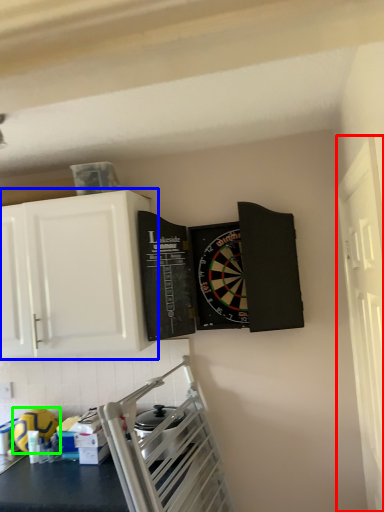
Question: Which object is positioned farthest from window (highlighted by a red box)? Select from cabinetry (highlighted by a blue box) and appliance (highlighted by a green box).

Choices:
 (A) cabinetry
 (B) appliance

Answer: (B)